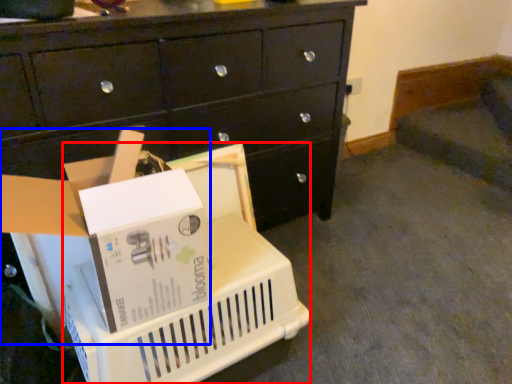
Question: Which point is further to the camera, basket (highlighted by a red box) or storage box (highlighted by a blue box)?

Choices:
 (A) basket
 (B) storage box

Answer: (A)